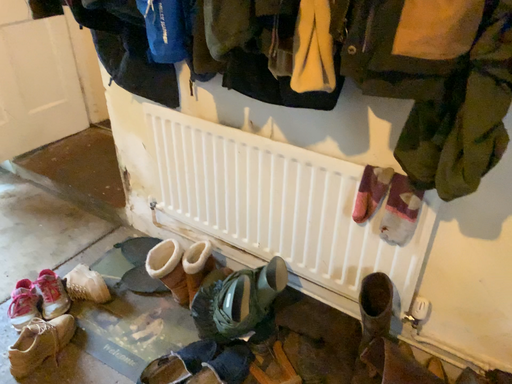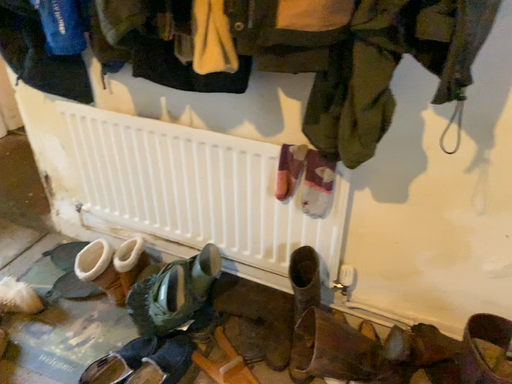
Question: Which way did the camera rotate in the video?

Choices:
 (A) rotated right
 (B) rotated left

Answer: (A)